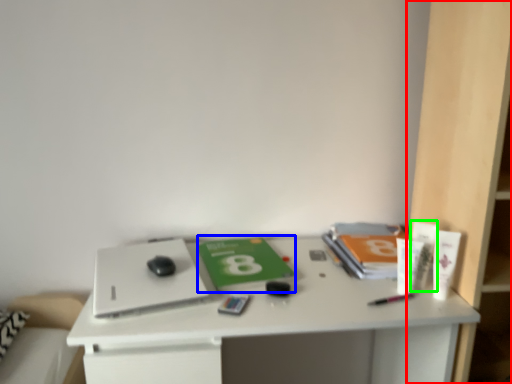
Question: Which is farther away from bookshelf (highlighted by a red box)? paperback book (highlighted by a blue box) or toiletry (highlighted by a green box)?

Choices:
 (A) paperback book
 (B) toiletry

Answer: (A)